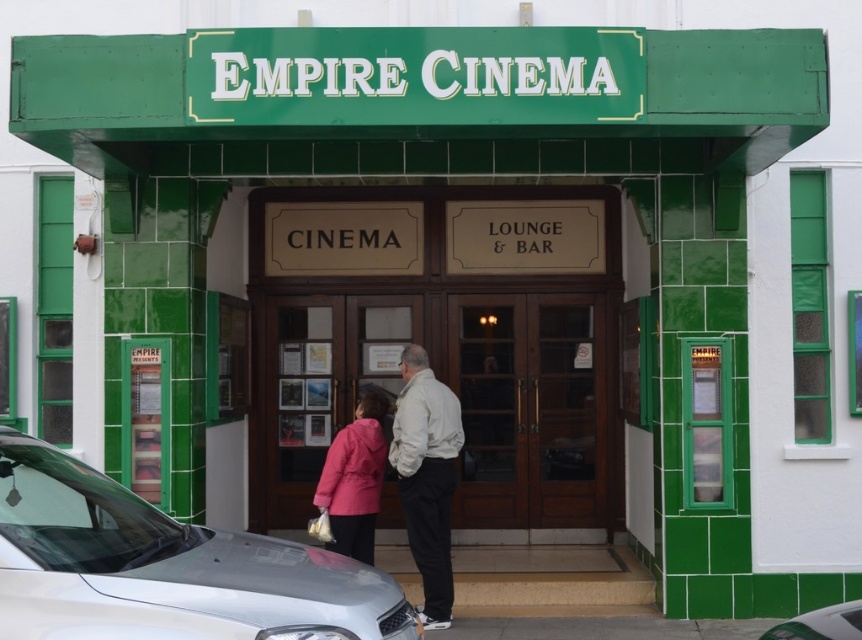
You are standing at the entrance of the Empire Cinema and want to enter the building. You see the wooden doors at center and the silver metallic car at lower left. Which object is closer to you?

The wooden doors at center are closer to you because they are further to the viewer than the silver metallic car at lower left, meaning they are positioned nearer in the scene.

In the scene shown: You are standing at the entrance of the Empire Cinema and notice two points marked on the facade. The first point is at coordinate point (105, 492) and the second is at point (842, 621). Which point is closer to you?

The point at (105, 492) is closer to you because it is further to the camera than the point at (842, 621).